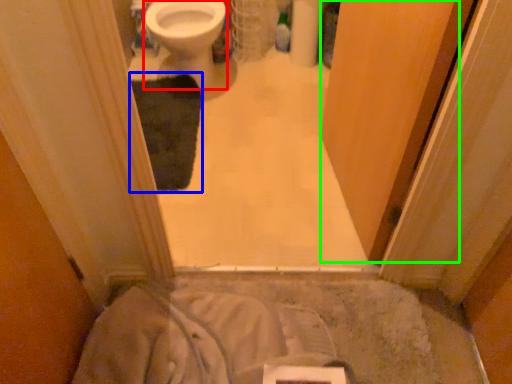
Question: Which is farther away from bidet (highlighted by a red box)? bath mat (highlighted by a blue box) or screen door (highlighted by a green box)?

Choices:
 (A) bath mat
 (B) screen door

Answer: (B)